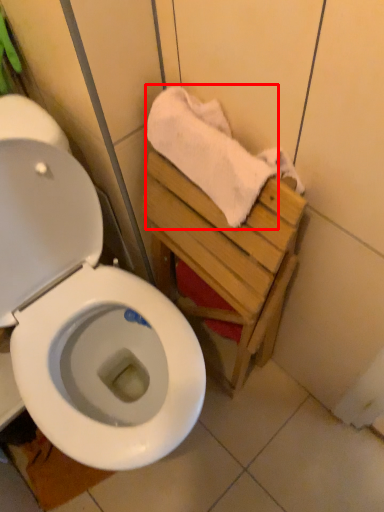
Question: From the image's perspective, what is the correct spatial relationship of bath towel (annotated by the red box) in relation to tile?

Choices:
 (A) below
 (B) above

Answer: (B)